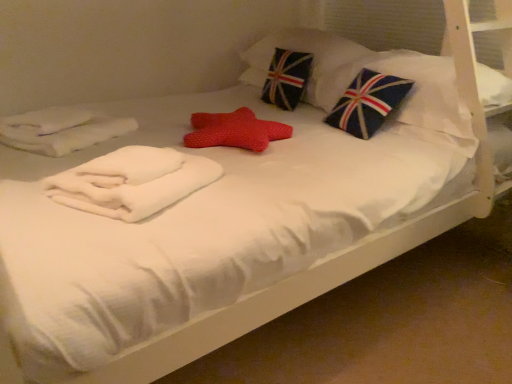
Question: Is white soft towel at center turned away from union jack fabric pillow at upper center, marked as the 1th pillow in a back-to-front arrangement?

Choices:
 (A) no
 (B) yes

Answer: (B)

Question: Is white soft towel at center outside union jack fabric pillow at upper center, which ranks as the 2th pillow in front-to-back order?

Choices:
 (A) no
 (B) yes

Answer: (B)

Question: From a real-world perspective, does white soft towel at center stand above union jack fabric pillow at upper center, which ranks as the 2th pillow in front-to-back order?

Choices:
 (A) yes
 (B) no

Answer: (B)

Question: Can you confirm if white soft towel at center is thinner than union jack fabric pillow at upper center, which ranks as the 2th pillow in front-to-back order?

Choices:
 (A) no
 (B) yes

Answer: (B)

Question: From the image's perspective, is white soft towel at center below union jack fabric pillow at upper center, which ranks as the 2th pillow in front-to-back order?

Choices:
 (A) no
 (B) yes

Answer: (B)

Question: Is union jack fabric pillow at upper center, which ranks as the 2th pillow in front-to-back order, completely or partially inside white soft towel at center?

Choices:
 (A) no
 (B) yes

Answer: (A)

Question: Considering the relative sizes of white soft towel at center and blue fabric pillow with flag design at upper right, which is counted as the 1th pillow, starting from the front, in the image provided, is white soft towel at center taller than blue fabric pillow with flag design at upper right, which is counted as the 1th pillow, starting from the front,?

Choices:
 (A) yes
 (B) no

Answer: (B)

Question: Is white soft towel at center in front of blue fabric pillow with flag design at upper right, positioned as the second pillow in back-to-front order?

Choices:
 (A) no
 (B) yes

Answer: (B)

Question: Is white soft towel at center to the right of blue fabric pillow with flag design at upper right, which is counted as the 1th pillow, starting from the front, from the viewer's perspective?

Choices:
 (A) no
 (B) yes

Answer: (A)

Question: Can you confirm if white soft towel at center is positioned to the left of blue fabric pillow with flag design at upper right, which is counted as the 1th pillow, starting from the front?

Choices:
 (A) no
 (B) yes

Answer: (B)

Question: From the image's perspective, is white soft towel at center below blue fabric pillow with flag design at upper right, positioned as the second pillow in back-to-front order?

Choices:
 (A) no
 (B) yes

Answer: (B)

Question: Does white soft towel at center have a larger size compared to blue fabric pillow with flag design at upper right, which is counted as the 1th pillow, starting from the front?

Choices:
 (A) yes
 (B) no

Answer: (B)

Question: Are union jack fabric pillow at upper center, which ranks as the 2th pillow in front-to-back order, and white soft towel at center far apart?

Choices:
 (A) yes
 (B) no

Answer: (A)